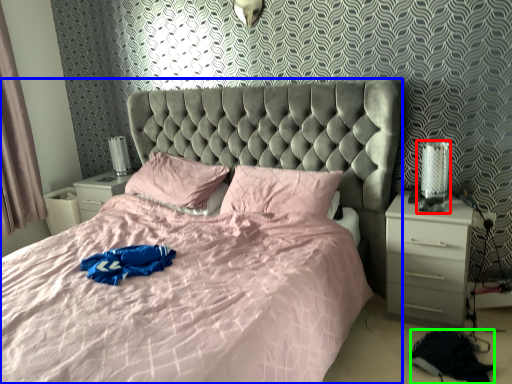
Question: Which is farther away from table lamp (highlighted by a red box)? bed (highlighted by a blue box) or material (highlighted by a green box)?

Choices:
 (A) bed
 (B) material

Answer: (A)